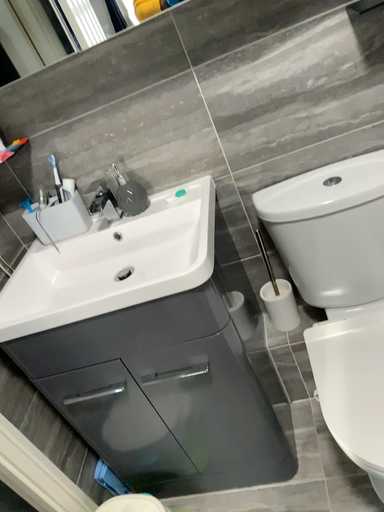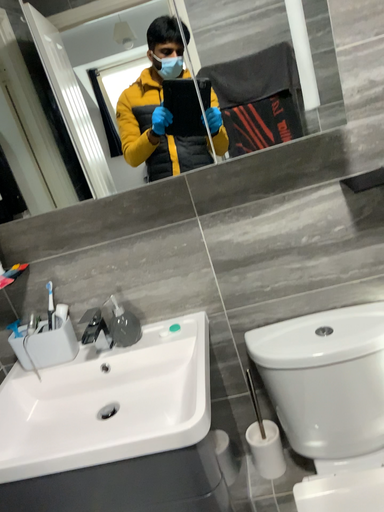
Question: How did the camera likely rotate when shooting the video?

Choices:
 (A) rotated downward
 (B) rotated upward

Answer: (B)